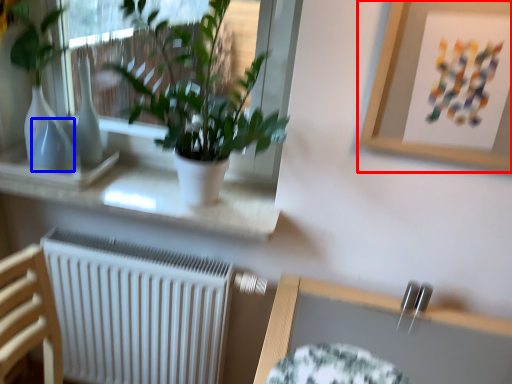
Question: Which object appears farthest to the camera in this image, picture frame (highlighted by a red box) or vase (highlighted by a blue box)?

Choices:
 (A) picture frame
 (B) vase

Answer: (B)